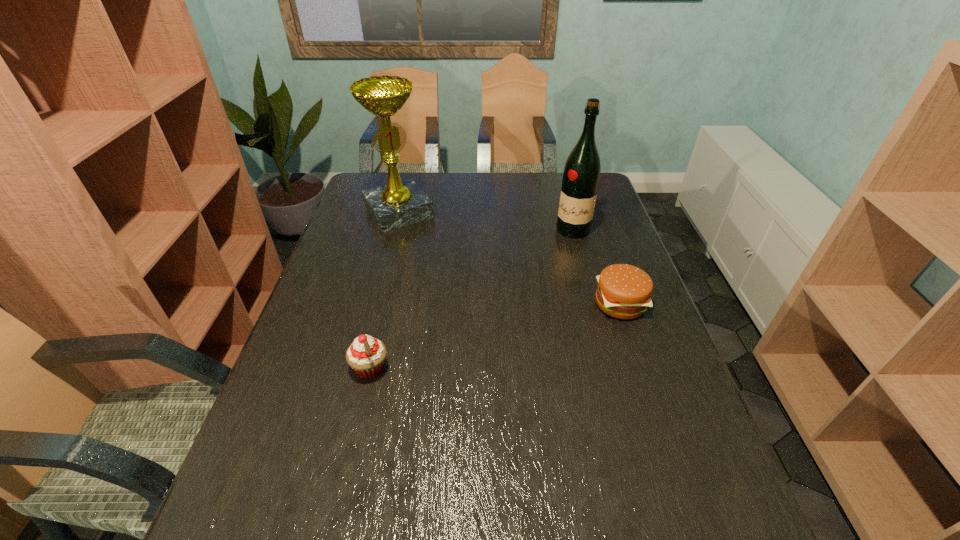
Find the location of a particular element. vacant space located 0.300m on the front-facing side of the award is located at coordinates tap(454, 282).

Image resolution: width=960 pixels, height=540 pixels. Identify the location of vacant space located on the front-facing side of the liquor. (529, 292).

You are a GUI agent. You are given a task and a screenshot of the screen. Output one action in this format:
    pyautogui.click(x=<x>, y=<y>)
    Task: Click on the free space located 0.400m on the front-facing side of the liquor
    The image size is (960, 540).
    Given the screenshot: What is the action you would take?
    pyautogui.click(x=512, y=317)

The height and width of the screenshot is (540, 960). In order to click on free space located 0.390m on the front-facing side of the liquor in this screenshot , I will do `click(513, 314)`.

Locate an element on the screen. This screenshot has width=960, height=540. object located at the far edge is located at coordinates (399, 203).

Locate an element on the screen. The height and width of the screenshot is (540, 960). cupcake that is positioned at the left edge is located at coordinates (366, 355).

Where is `award that is at the left edge`? This screenshot has width=960, height=540. award that is at the left edge is located at coordinates (399, 203).

Locate an element on the screen. The image size is (960, 540). hamburger that is positioned at the right edge is located at coordinates (624, 291).

At what (x,y) coordinates should I click in order to perform the action: click on liquor at the right edge. Please return your answer as a coordinate pair (x, y). The image size is (960, 540). Looking at the image, I should click on (581, 176).

This screenshot has width=960, height=540. Find the location of `object located in the far left corner section of the desktop`. object located in the far left corner section of the desktop is located at coordinates (399, 203).